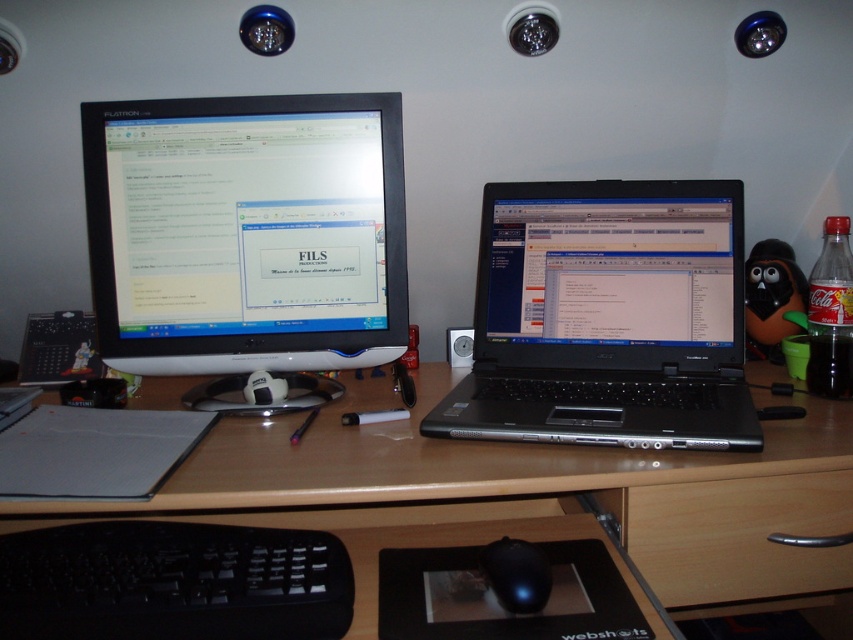
You are organizing cables on the desk and need to connect a new cable from the satin black monitor at upper left to the black matte mouse at center. Considering their positions, which object is closer to you to start routing the cable from?

The satin black monitor at upper left is closer to you than the black matte mouse at center, so you should start routing the cable from the satin black monitor at upper left.

You need to place a wireless charger between the black plastic laptop at center and the black matte mouse at center. The charger has a diameter of 4 inches. Is there enough space between them for the charger?

The distance between the black plastic laptop at center and the black matte mouse at center is 12.09 inches. Since the charger requires 4 inches of space, there is sufficient room to place it between them.

You are navigating a virtual desk environment where you must move from one point to another. You start at point (492, 572) and need to reach point (175, 298). According to the workspace layout, which direction should you move first to reach your destination?

You should move backward first because point (175, 298) is behind point (492, 572) in the workspace layout.